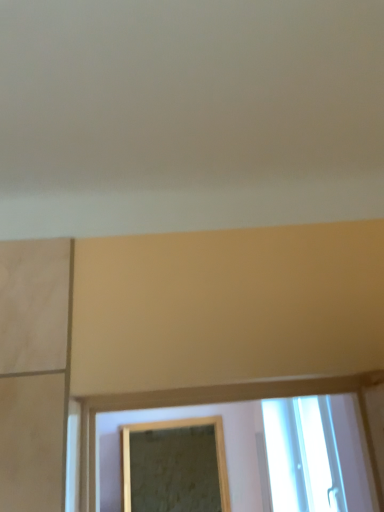
What do you see at coordinates (174, 470) in the screenshot?
I see `gold-framed mirror at center` at bounding box center [174, 470].

Where is `gold-framed mirror at center`? This screenshot has width=384, height=512. gold-framed mirror at center is located at coordinates (174, 470).

This screenshot has height=512, width=384. Identify the location of transparent glass window at lower right. (303, 456).

Measure the distance between transparent glass window at lower right and camera.

A distance of 2.16 meters exists between transparent glass window at lower right and camera.

This screenshot has width=384, height=512. Describe the element at coordinates (303, 456) in the screenshot. I see `transparent glass window at lower right` at that location.

I want to click on gold-framed mirror at center, so click(x=174, y=470).

Based on the photo, considering the relative positions of transparent glass window at lower right and gold-framed mirror at center in the image provided, is transparent glass window at lower right to the left or to the right of gold-framed mirror at center?

transparent glass window at lower right is positioned on gold-framed mirror at center's right side.

Which object is further away from the camera, transparent glass window at lower right or gold-framed mirror at center?

gold-framed mirror at center.

Does point (293, 411) lie in front of point (166, 449)?

Yes, it is.

From the image's perspective, which object appears higher, transparent glass window at lower right or gold-framed mirror at center?

transparent glass window at lower right.

From a real-world perspective, is transparent glass window at lower right on gold-framed mirror at center?

Yes.

Which object is wider, transparent glass window at lower right or gold-framed mirror at center?

With larger width is gold-framed mirror at center.

Consider the image. In terms of height, does transparent glass window at lower right look taller or shorter compared to gold-framed mirror at center?

Considering their sizes, transparent glass window at lower right has less height than gold-framed mirror at center.

Consider the image. Based on their sizes in the image, would you say transparent glass window at lower right is bigger or smaller than gold-framed mirror at center?

In the image, transparent glass window at lower right appears to be smaller than gold-framed mirror at center.

Would you say transparent glass window at lower right contains gold-framed mirror at center?

That's incorrect, gold-framed mirror at center is not inside transparent glass window at lower right.

From the picture: Does transparent glass window at lower right touch gold-framed mirror at center?

No, transparent glass window at lower right is not in contact with gold-framed mirror at center.

Is transparent glass window at lower right facing away from gold-framed mirror at center?

No.

Locate an element on the screen. The height and width of the screenshot is (512, 384). mirror below the transparent glass window at lower right (from the image's perspective) is located at coordinates (174, 470).

Based on the photo, in the image, is gold-framed mirror at center on the left side or the right side of transparent glass window at lower right?

gold-framed mirror at center is positioned on transparent glass window at lower right's left side.

Is the position of gold-framed mirror at center less distant than that of transparent glass window at lower right?

That is False.

Does point (192, 438) appear closer or farther from the camera than point (331, 438)?

Clearly, point (192, 438) is more distant from the camera than point (331, 438).

From the image's perspective, is gold-framed mirror at center beneath transparent glass window at lower right?

Correct, gold-framed mirror at center appears lower than transparent glass window at lower right in the image.

From a real-world perspective, between gold-framed mirror at center and transparent glass window at lower right, who is vertically lower?

gold-framed mirror at center, from a real-world perspective.

Does gold-framed mirror at center have a greater width compared to transparent glass window at lower right?

Correct, the width of gold-framed mirror at center exceeds that of transparent glass window at lower right.

Considering the relative sizes of gold-framed mirror at center and transparent glass window at lower right in the image provided, is gold-framed mirror at center shorter than transparent glass window at lower right?

No.

Considering the relative sizes of gold-framed mirror at center and transparent glass window at lower right in the image provided, is gold-framed mirror at center bigger than transparent glass window at lower right?

Yes, gold-framed mirror at center is bigger than transparent glass window at lower right.

Is transparent glass window at lower right inside gold-framed mirror at center?

No, transparent glass window at lower right is not a part of gold-framed mirror at center.

Is there a large distance between gold-framed mirror at center and transparent glass window at lower right?

That's right, there is a large distance between gold-framed mirror at center and transparent glass window at lower right.

Does gold-framed mirror at center turn towards transparent glass window at lower right?

Yes, gold-framed mirror at center faces towards transparent glass window at lower right.

How many degrees apart are the facing directions of gold-framed mirror at center and transparent glass window at lower right?

There is a 90-degree angle between the facing directions of gold-framed mirror at center and transparent glass window at lower right.

The image size is (384, 512). Identify the location of window that is on the right side of gold-framed mirror at center. (303, 456).

Find the location of a particular element. The height and width of the screenshot is (512, 384). mirror below the transparent glass window at lower right (from the image's perspective) is located at coordinates (174, 470).

I want to click on window on the right of gold-framed mirror at center, so click(303, 456).